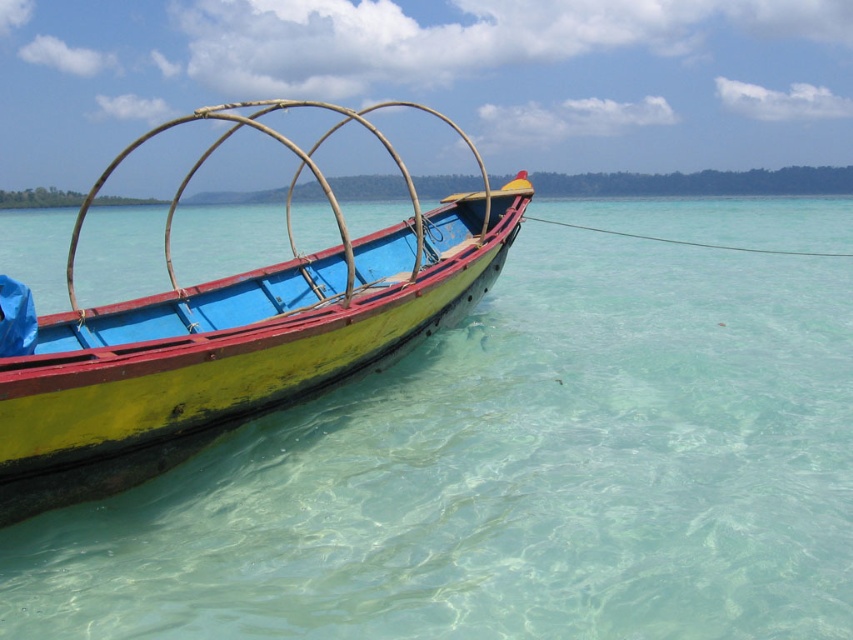
Is clear water at boat left to the right of yellow matte boat at center from the viewer's perspective?

Yes, clear water at boat left is to the right of yellow matte boat at center.

Is clear water at boat left positioned behind yellow matte boat at center?

No, clear water at boat left is in front of yellow matte boat at center.

Between point (399, 449) and point (161, 333), which one is positioned behind?

Point (161, 333)

At what (x,y) coordinates should I click in order to perform the action: click on clear water at boat left. Please return your answer as a coordinate pair (x, y). The height and width of the screenshot is (640, 853). Looking at the image, I should click on (509, 476).